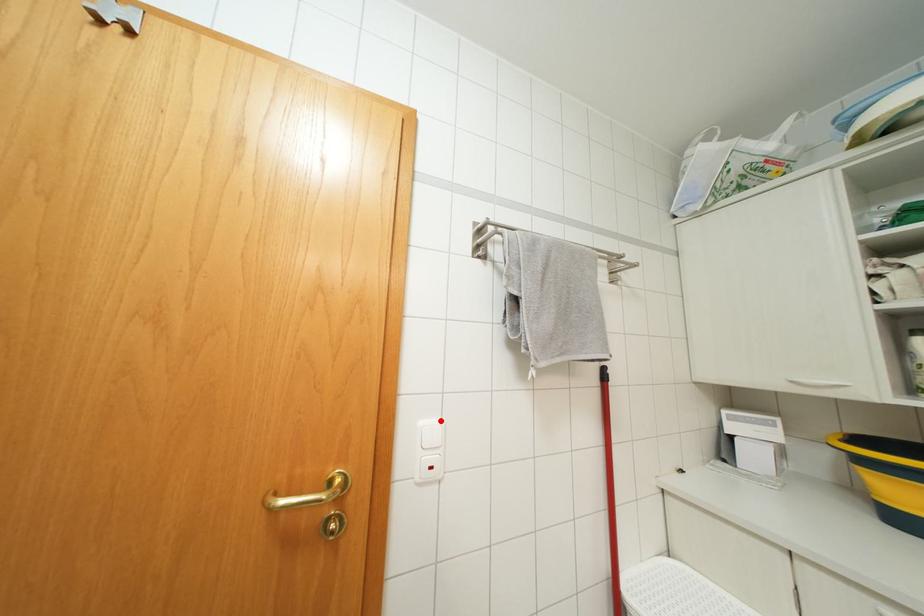
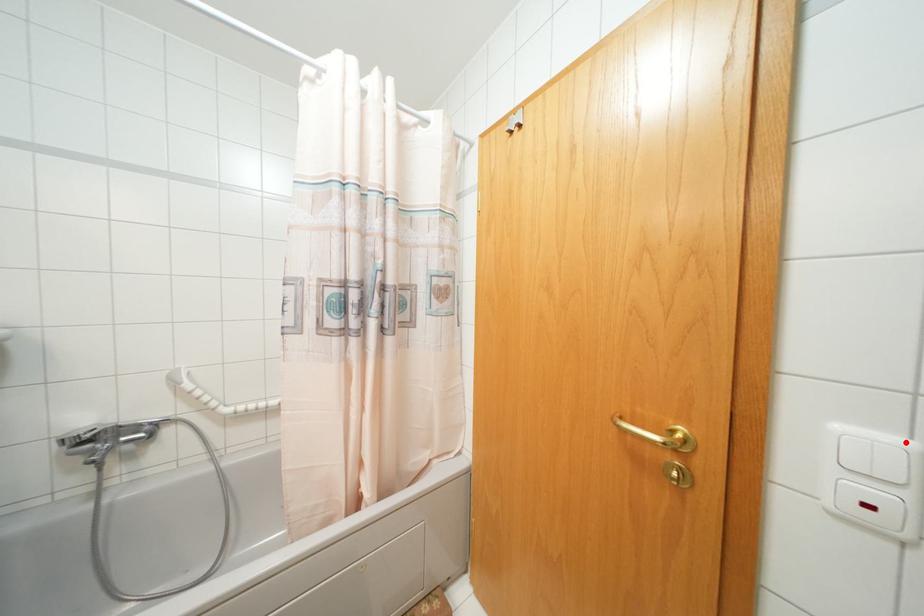
I am providing you with two images of the same scene from different viewpoints. A red point is marked on the first image and another point is marked on the second image. Does the point marked in image1 correspond to the same location as the one in image2?

Yes